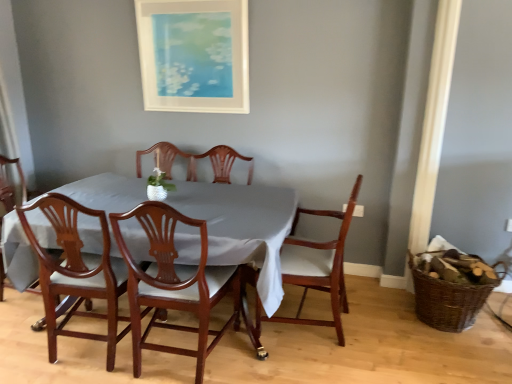
Question: Looking at the image, does mahogany table at center seem bigger or smaller compared to brown woven basket at right?

Choices:
 (A) small
 (B) big

Answer: (B)

Question: Is mahogany table at center inside the boundaries of brown woven basket at right, or outside?

Choices:
 (A) outside
 (B) inside

Answer: (A)

Question: Which of these objects is positioned farthest from the mahogany wood chair at lower left, positioned as the 3th chair in right-to-left order?

Choices:
 (A) mahogany wood chair at center, which ranks as the 3th chair in left-to-right order
 (B) matte white picture frame at upper center
 (C) mahogany table at center
 (D) mahogany wood chair at center, the 1th chair positioned from the right
 (E) mahogany wood chair at lower left, which is the 4th chair in right-to-left order

Answer: (B)

Question: Which of these objects is positioned farthest from the mahogany wood chair at lower left, which is the first chair from left to right?

Choices:
 (A) mahogany wood chair at lower left, the 2th chair viewed from the left
 (B) mahogany table at center
 (C) brown woven basket at right
 (D) mahogany wood chair at center, which is the fourth chair in left-to-right order
 (E) matte white picture frame at upper center

Answer: (C)